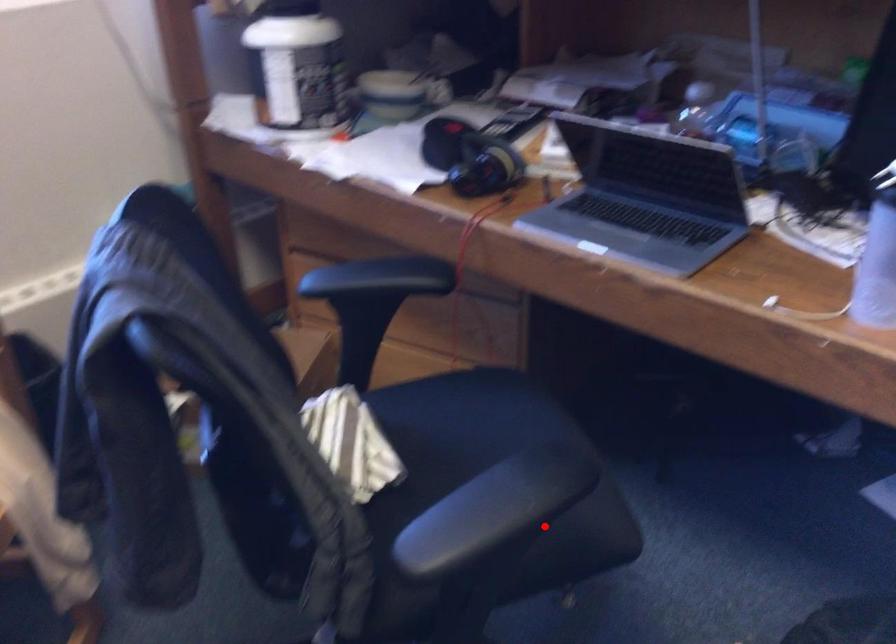
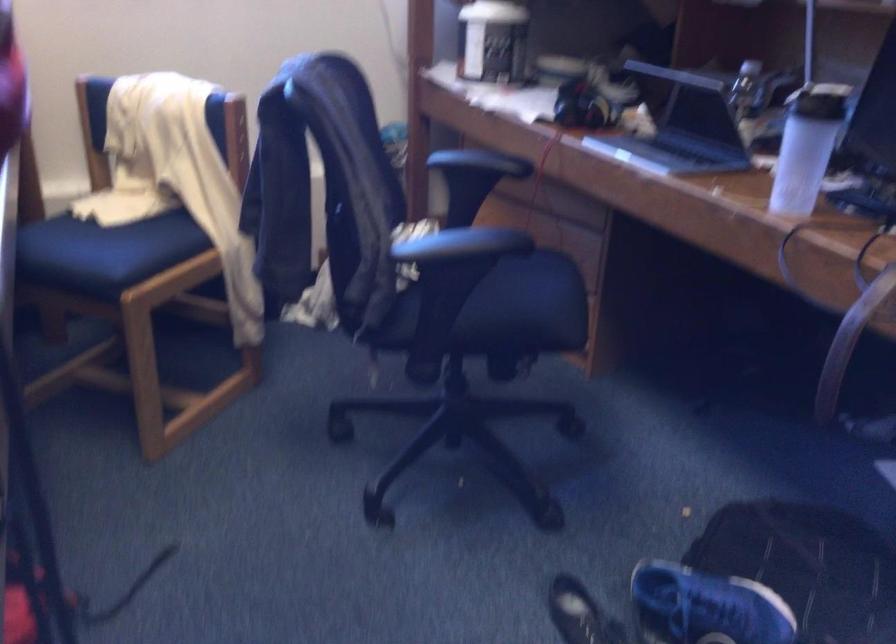
Question: I am providing you with two images of the same scene from different viewpoints. A red point is shown in image1. For the corresponding object point in image2, is it positioned nearer or farther from the camera?

Choices:
 (A) Nearer
 (B) Farther

Answer: (B)